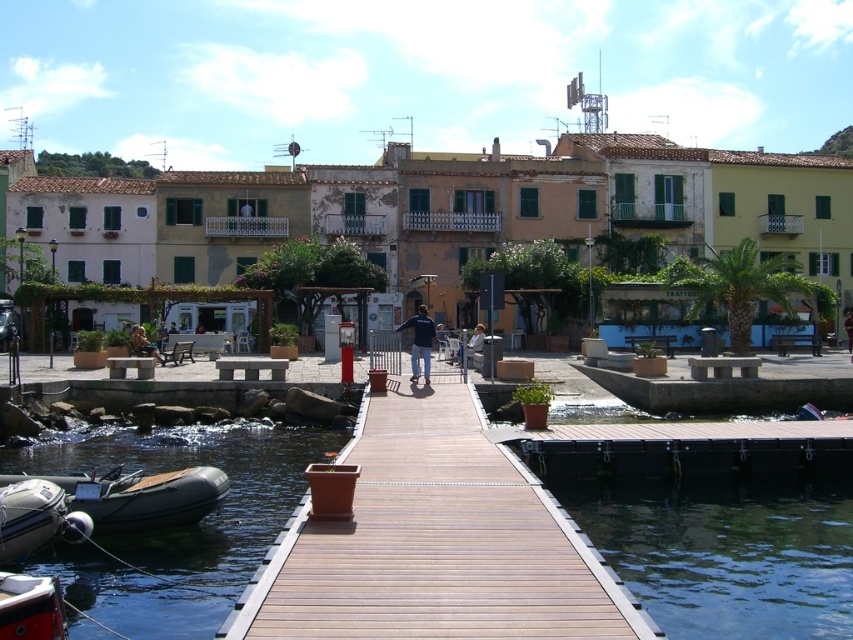
Does point (817, 556) lie behind point (161, 364)?

That is False.

Who is taller, transparent blue water at dock center or dark blue jeans at center?

transparent blue water at dock center is taller.

Does point (811, 605) come in front of point (146, 348)?

Yes, it is.

Where is `transparent blue water at dock center`? transparent blue water at dock center is located at coordinates (726, 556).

Can you confirm if brown wooden dock at center is bigger than rubber/inflatable boat at lower left?

Yes, brown wooden dock at center is bigger than rubber/inflatable boat at lower left.

Is brown wooden dock at center closer to camera compared to rubber/inflatable boat at lower left?

Yes, brown wooden dock at center is in front of rubber/inflatable boat at lower left.

Measure the distance between brown wooden dock at center and camera.

brown wooden dock at center and camera are 17.07 meters apart from each other.

What are the coordinates of `brown wooden dock at center` in the screenshot? It's located at (434, 541).

Who is more distant from viewer, (407, 321) or (154, 355)?

The point (407, 321) is behind.

Does dark blue jacket at center lie behind dark blue jeans at center?

That is False.

At what (x,y) coordinates should I click in order to perform the action: click on dark blue jacket at center. Please return your answer as a coordinate pair (x, y). Looking at the image, I should click on (421, 340).